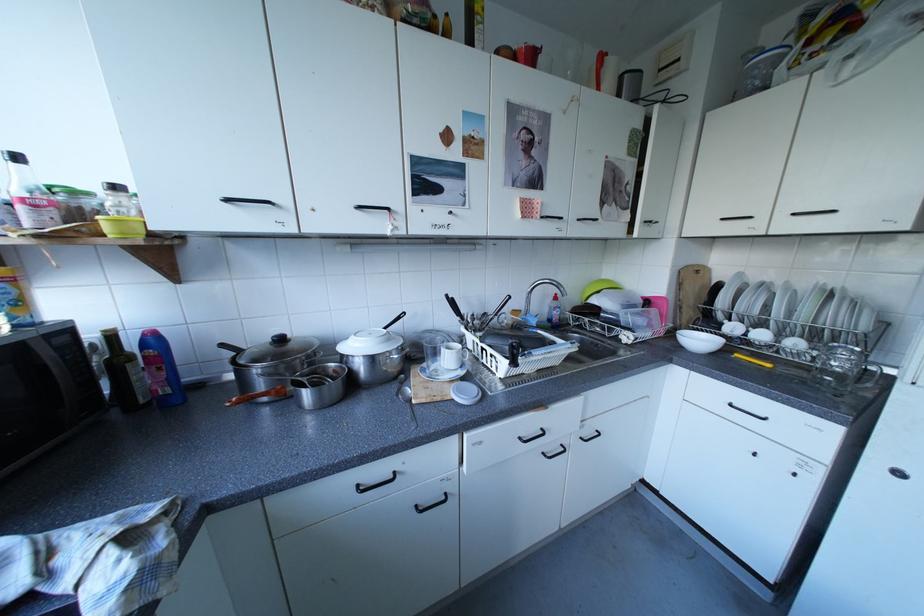
Where is `white bowl`? The width and height of the screenshot is (924, 616). white bowl is located at coordinates (699, 341).